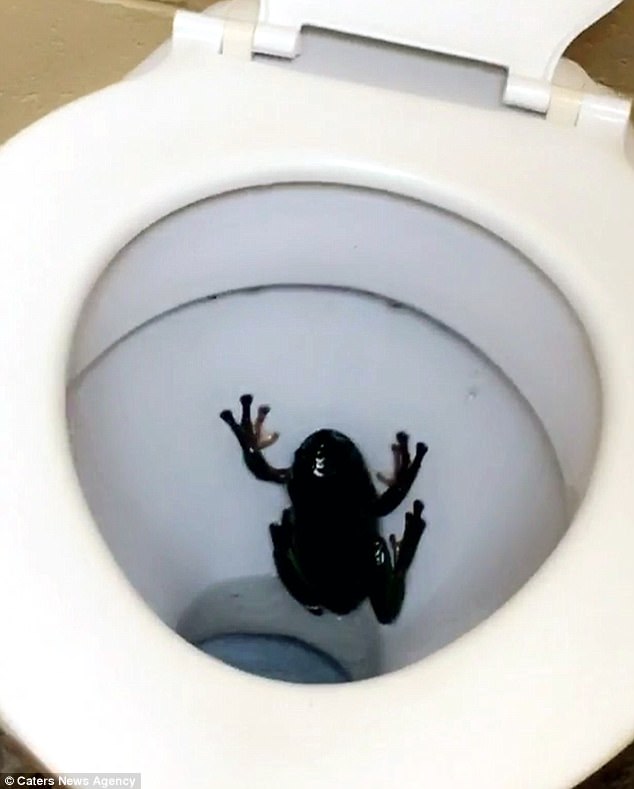
Locate an element on the screen. This screenshot has height=789, width=634. toilet seat lid is located at coordinates (447, 10).